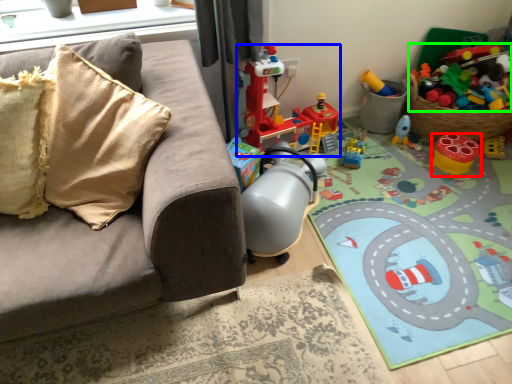
Question: Which object is the farthest from toy (highlighted by a red box)? Choose among these: toy (highlighted by a blue box) or toy (highlighted by a green box).

Choices:
 (A) toy
 (B) toy

Answer: (A)